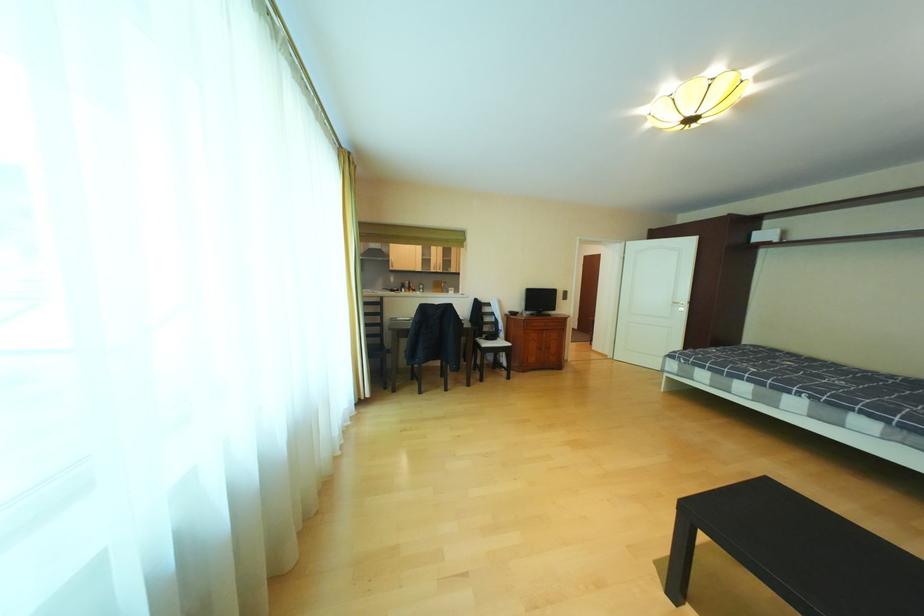
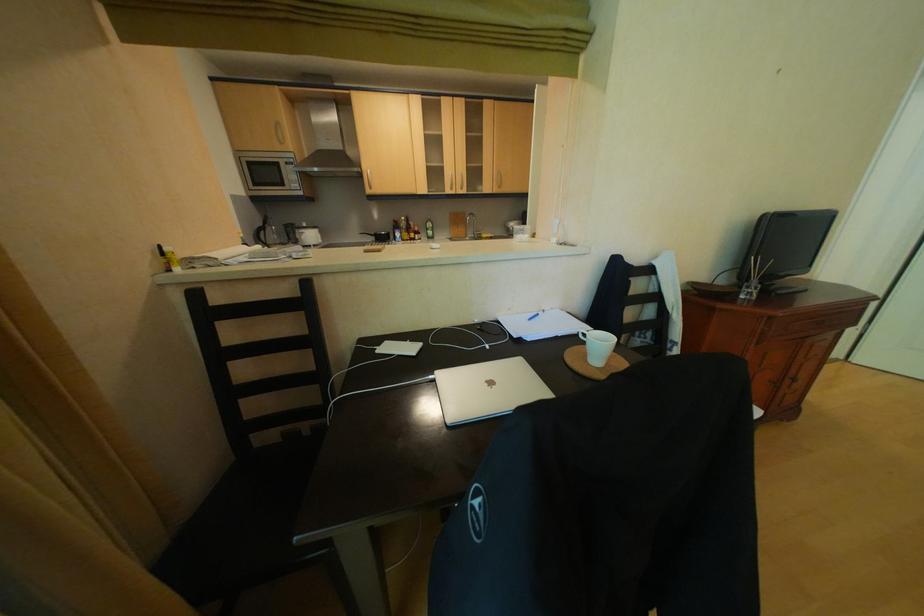
Question: What movement of the cameraman would produce the second image?

Choices:
 (A) Left
 (B) Right
 (C) Forward
 (D) Backward

Answer: (C)